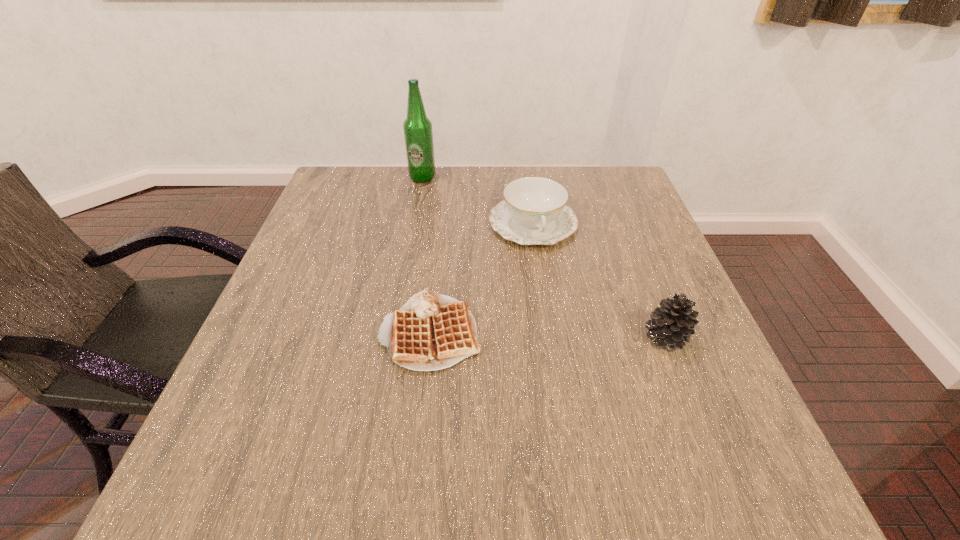
Where is `the shortest object`? This screenshot has width=960, height=540. the shortest object is located at coordinates (431, 331).

At what (x,y) coordinates should I click in order to perform the action: click on pinecone. Please return your answer as a coordinate pair (x, y). The width and height of the screenshot is (960, 540). Looking at the image, I should click on (672, 324).

You are a GUI agent. You are given a task and a screenshot of the screen. Output one action in this format:
    pyautogui.click(x=<x>, y=<y>)
    Task: Click on the rightmost object
    This screenshot has width=960, height=540.
    Given the screenshot: What is the action you would take?
    pyautogui.click(x=672, y=324)

Locate an element on the screen. the third tallest object is located at coordinates pos(534,211).

Locate an element on the screen. This screenshot has height=540, width=960. chinaware is located at coordinates (534, 211).

Where is `the tallest object`? the tallest object is located at coordinates (418, 134).

Where is `beer bottle`? The width and height of the screenshot is (960, 540). beer bottle is located at coordinates (418, 134).

Where is `free space located on the back of the waffle`? This screenshot has width=960, height=540. free space located on the back of the waffle is located at coordinates pos(439,255).

You are a GUI agent. You are given a task and a screenshot of the screen. Output one action in this format:
    pyautogui.click(x=<x>, y=<y>)
    Task: Click on the free region located on the left of the third shortest object
    
    Given the screenshot: What is the action you would take?
    pyautogui.click(x=460, y=338)

What are the coordinates of `blank space located on the handle side of the third nearest object` in the screenshot? It's located at (574, 350).